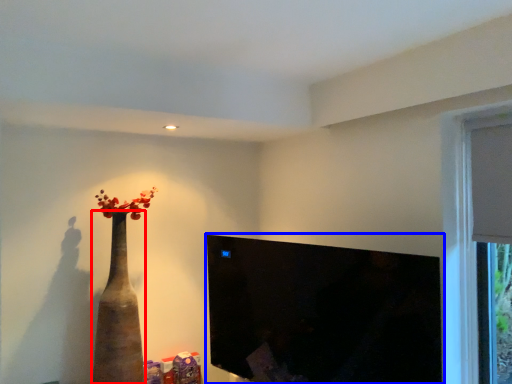
Question: Among these objects, which one is nearest to the camera, vase (highlighted by a red box) or window screen (highlighted by a blue box)?

Choices:
 (A) vase
 (B) window screen

Answer: (B)